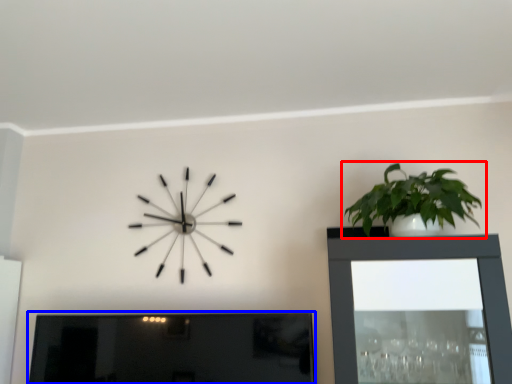
Question: Which of the following is the farthest to the observer, houseplant (highlighted by a red box) or picture frame (highlighted by a blue box)?

Choices:
 (A) houseplant
 (B) picture frame

Answer: (B)